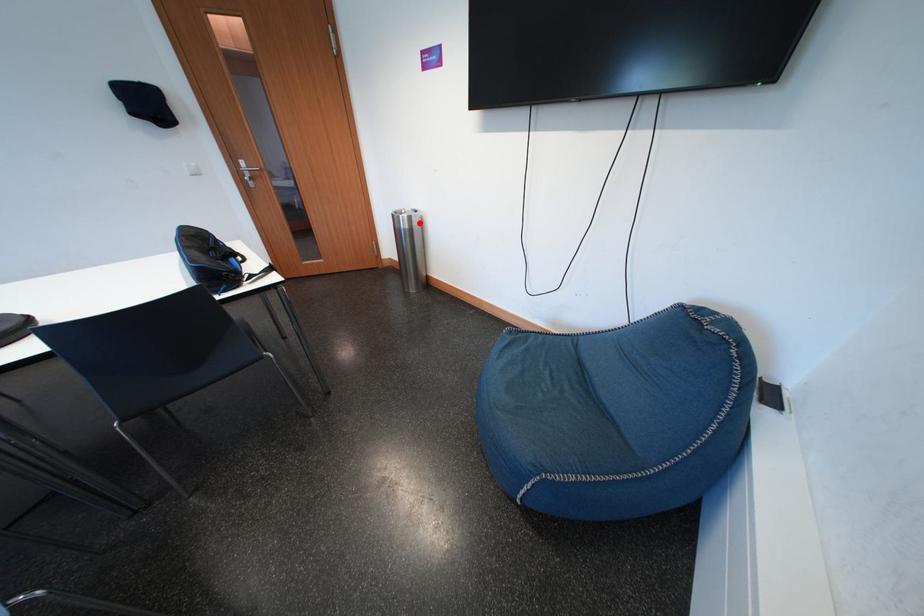
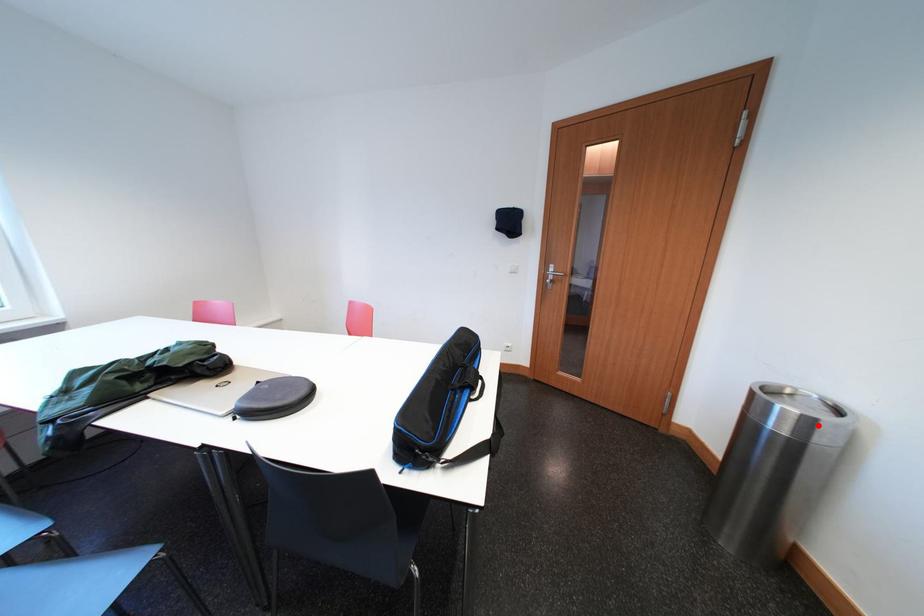
I am providing you with two images of the same scene from different viewpoints. A red point is marked on the first image and another point is marked on the second image. Are the points marked in image1 and image2 representing the same 3D position?

Yes